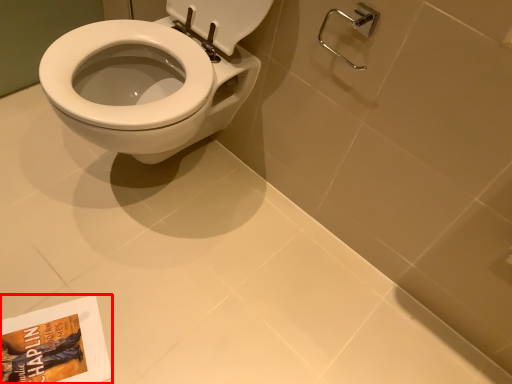
Question: Considering the relative positions of paperback book (annotated by the red box) and shower in the image provided, where is paperback book (annotated by the red box) located with respect to the staircase?

Choices:
 (A) right
 (B) left

Answer: (B)